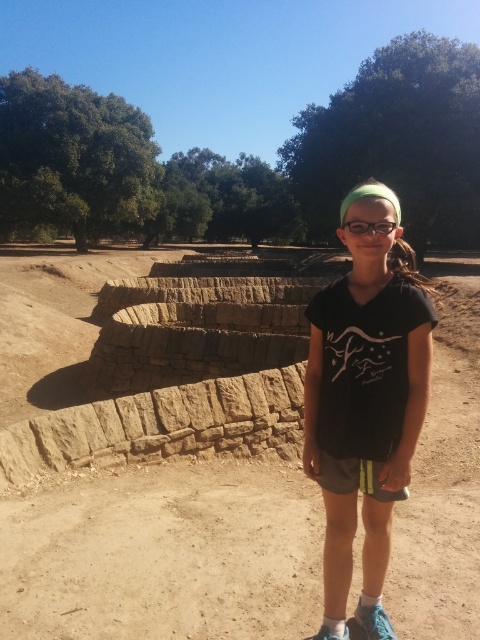
Is point (284, 548) closer to camera compared to point (384, 225)?

No, it is behind (384, 225).

Looking at this image, is brown dirt field at center closer to the viewer compared to black matte t-shirt at center?

No, brown dirt field at center is further to the viewer.

You are a GUI agent. You are given a task and a screenshot of the screen. Output one action in this format:
    pyautogui.click(x=<x>, y=<y>)
    Task: Click on the brown dirt field at center
    
    Given the screenshot: What is the action you would take?
    pyautogui.click(x=163, y=556)

At what (x,y) coordinates should I click in order to perform the action: click on brown dirt field at center. Please return your answer as a coordinate pair (x, y). This screenshot has width=480, height=640. Looking at the image, I should click on (163, 556).